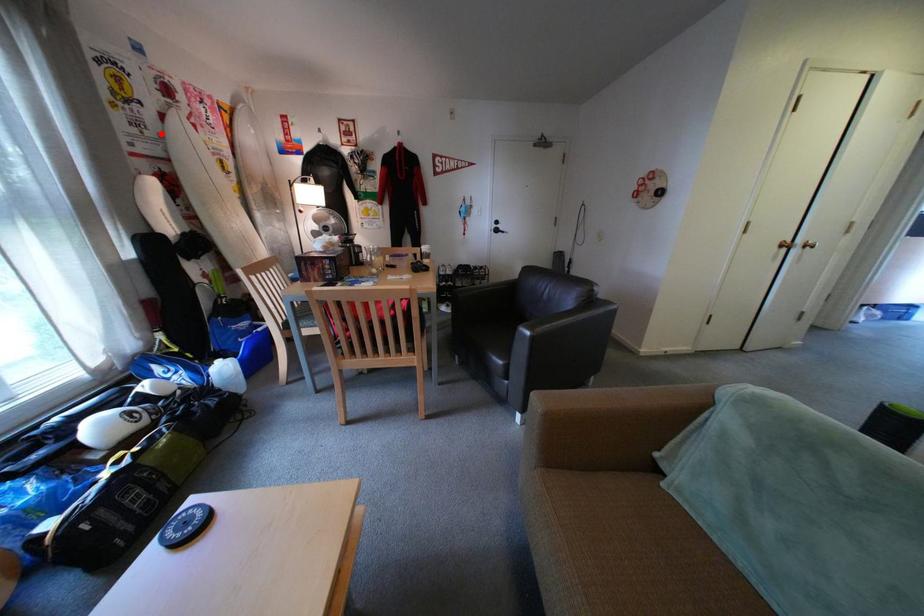
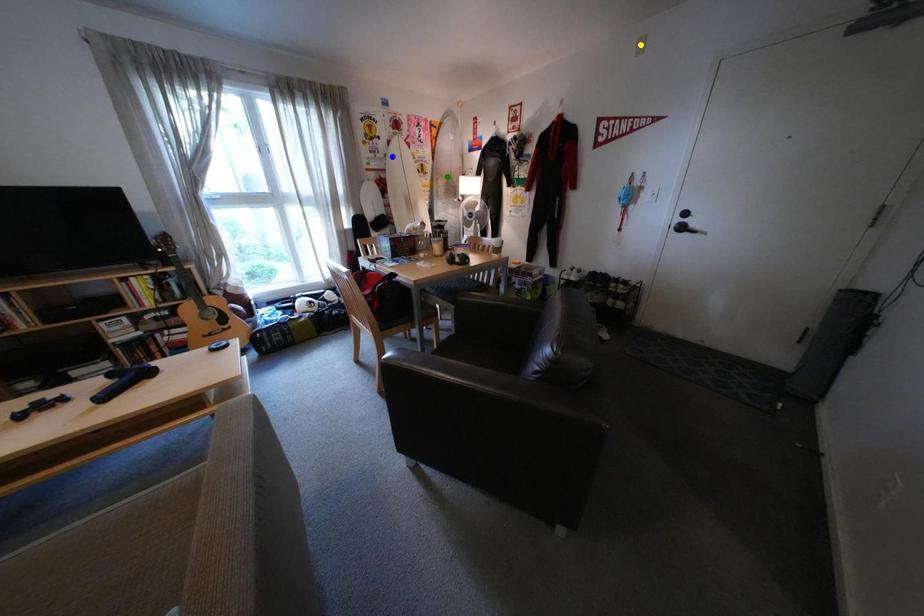
Question: I am providing you with two images of the same scene from different viewpoints. A red point is marked on the first image. You are given multiple points on the second image. Which point in image 2 represents the same 3d spot as the red point in image 1?

Choices:
 (A) yellow point
 (B) green point
 (C) blue point

Answer: (C)